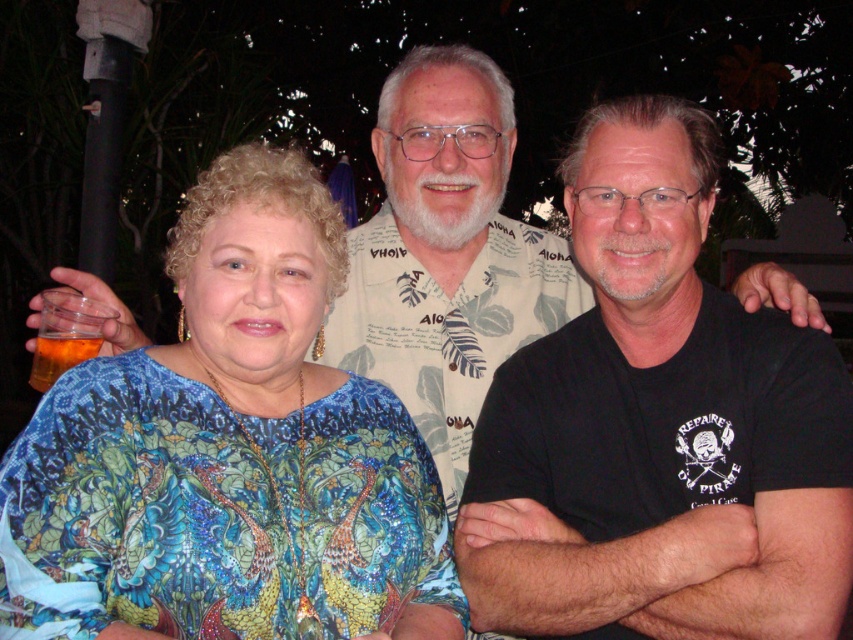
Is black matte t-shirt at center smaller than printed cotton shirt at center?

No.

Who is higher up, black matte t-shirt at center or printed cotton shirt at center?

printed cotton shirt at center

The width and height of the screenshot is (853, 640). Describe the element at coordinates (675, 394) in the screenshot. I see `black matte t-shirt at center` at that location.

In order to click on black matte t-shirt at center in this screenshot , I will do `click(675, 394)`.

Does shiny blue blouse at center have a greater height compared to translucent amber glass at lower left?

Yes, shiny blue blouse at center is taller than translucent amber glass at lower left.

You are a GUI agent. You are given a task and a screenshot of the screen. Output one action in this format:
    pyautogui.click(x=<x>, y=<y>)
    Task: Click on the shiny blue blouse at center
    
    Given the screenshot: What is the action you would take?
    pyautogui.click(x=229, y=454)

What do you see at coordinates (675, 394) in the screenshot? I see `black matte t-shirt at center` at bounding box center [675, 394].

Where is `black matte t-shirt at center`? This screenshot has height=640, width=853. black matte t-shirt at center is located at coordinates (675, 394).

Locate an element on the screen. The image size is (853, 640). black matte t-shirt at center is located at coordinates (675, 394).